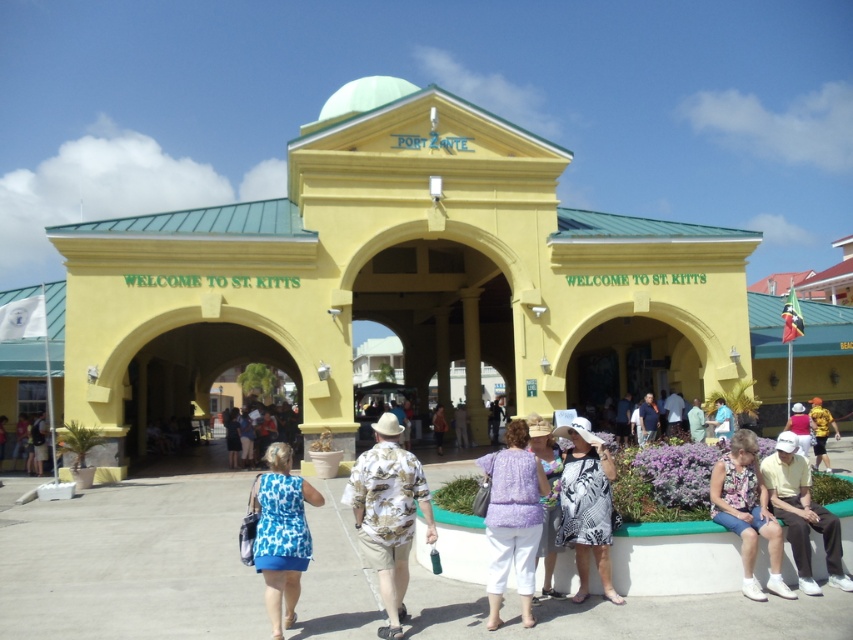
Between blue fabric dress at lower left and light blue fabric dress at center, which one is positioned lower?

blue fabric dress at lower left

Is blue fabric dress at lower left in front of light blue fabric dress at center?

That is True.

Is point (45, 436) in front of point (695, 429)?

Yes, point (45, 436) is in front of point (695, 429).

Locate an element on the screen. Image resolution: width=853 pixels, height=640 pixels. blue fabric dress at lower left is located at coordinates (39, 442).

Is floral print blouse at lower right thinner than matte blue shirt at center?

Yes.

Is floral print blouse at lower right further to camera compared to matte blue shirt at center?

No, it is not.

Between point (729, 474) and point (645, 400), which one is positioned behind?

Positioned behind is point (645, 400).

At what (x,y) coordinates should I click in order to perform the action: click on floral print blouse at lower right. Please return your answer as a coordinate pair (x, y). Image resolution: width=853 pixels, height=640 pixels. Looking at the image, I should click on (747, 512).

Between point (743, 483) and point (433, 420), which one is positioned behind?

Positioned behind is point (433, 420).

Is floral print blouse at lower right to the right of brown leather jacket at center from the viewer's perspective?

Indeed, floral print blouse at lower right is positioned on the right side of brown leather jacket at center.

Is point (778, 572) farther from camera compared to point (438, 428)?

No.

The width and height of the screenshot is (853, 640). Find the location of `floral print blouse at lower right`. floral print blouse at lower right is located at coordinates (747, 512).